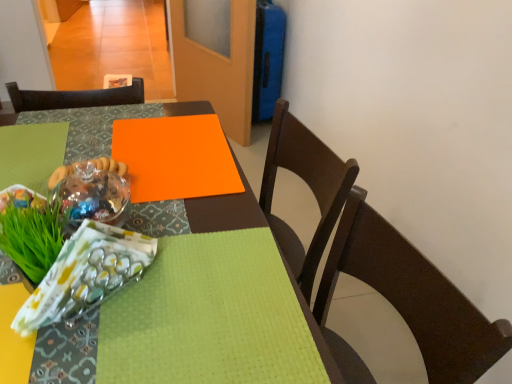
Question: From a real-world perspective, is green leafy grass at lower left on top of translucent plastic bag at lower left?

Choices:
 (A) yes
 (B) no

Answer: (B)

Question: Does green leafy grass at lower left turn towards translucent plastic bag at lower left?

Choices:
 (A) yes
 (B) no

Answer: (B)

Question: Can you confirm if green leafy grass at lower left is positioned to the left of translucent plastic bag at lower left?

Choices:
 (A) yes
 (B) no

Answer: (A)

Question: Is the position of green leafy grass at lower left less distant than that of translucent plastic bag at lower left?

Choices:
 (A) yes
 (B) no

Answer: (B)

Question: Is green leafy grass at lower left thinner than translucent plastic bag at lower left?

Choices:
 (A) no
 (B) yes

Answer: (A)

Question: From the image's perspective, is translucent plastic bag at lower left located above or below orange matte board at center?

Choices:
 (A) above
 (B) below

Answer: (B)

Question: From a real-world perspective, relative to orange matte board at center, is translucent plastic bag at lower left vertically above or below?

Choices:
 (A) above
 (B) below

Answer: (A)

Question: Is translucent plastic bag at lower left taller or shorter than orange matte board at center?

Choices:
 (A) short
 (B) tall

Answer: (B)

Question: Relative to orange matte board at center, is translucent plastic bag at lower left in front or behind?

Choices:
 (A) behind
 (B) front

Answer: (B)

Question: Is point (207, 163) closer or farther from the camera than point (0, 193)?

Choices:
 (A) closer
 (B) farther

Answer: (B)

Question: Considering the positions of orange matte board at center and green leafy grass at lower left in the image, is orange matte board at center bigger or smaller than green leafy grass at lower left?

Choices:
 (A) big
 (B) small

Answer: (A)

Question: Looking at their shapes, would you say orange matte board at center is wider or thinner than green leafy grass at lower left?

Choices:
 (A) thin
 (B) wide

Answer: (B)

Question: Choose the correct answer: Is orange matte board at center inside green leafy grass at lower left or outside it?

Choices:
 (A) outside
 (B) inside

Answer: (A)

Question: Looking at their shapes, would you say orange matte board at center is wider or thinner than translucent glass bowl at center?

Choices:
 (A) wide
 (B) thin

Answer: (A)

Question: Is orange matte board at center spatially inside translucent glass bowl at center, or outside of it?

Choices:
 (A) inside
 (B) outside

Answer: (B)